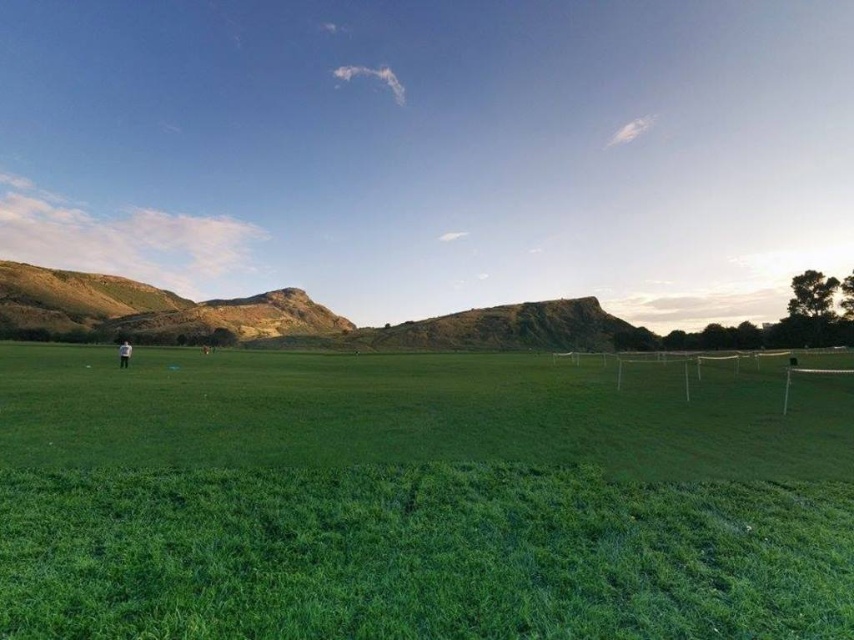
You are standing in the field and want to walk towards the green grass at center. Which direction should you walk relative to the white fabric person at left?

The green grass at center is in front of the white fabric person at left, so you should walk towards the direction of the green grass at center, which is in front of the white fabric person at left.

Imagine you are standing at the center of the field looking towards the tennis net on the right. Which direction should you walk to reach the green grass at center?

The green grass at center is already at your current position since you are standing at the center of the field.